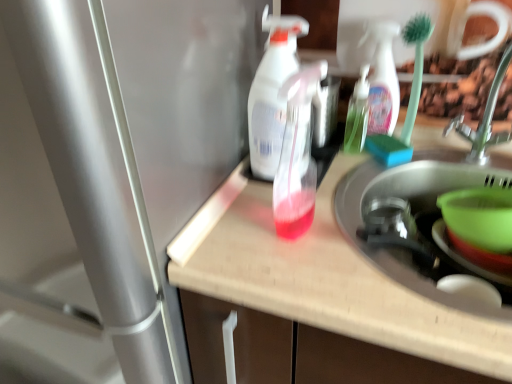
Identify the location of free space in front of translucent plastic bottle at center, the 1th bottle viewed from the right. The height and width of the screenshot is (384, 512). (350, 176).